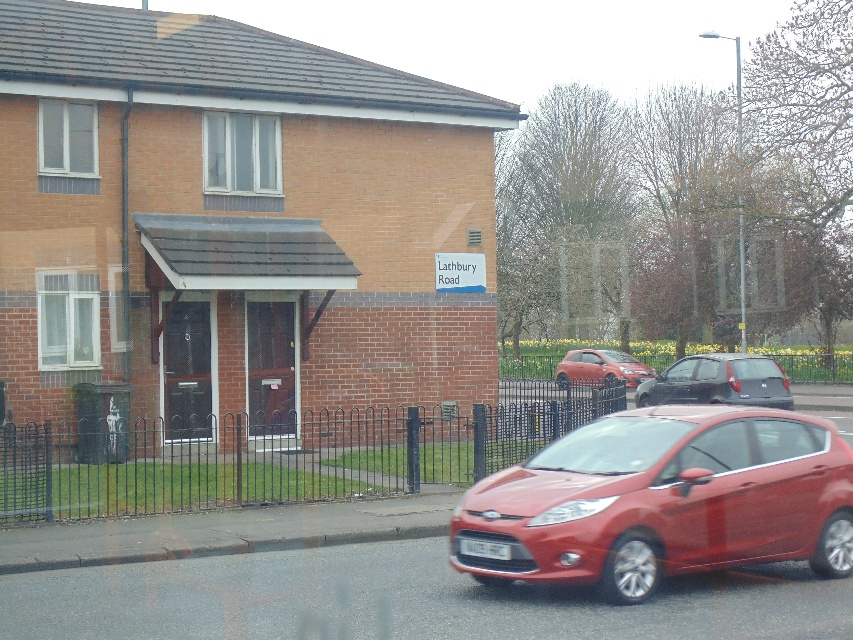
The height and width of the screenshot is (640, 853). Describe the element at coordinates (665, 500) in the screenshot. I see `matte red car at lower right` at that location.

Consider the image. Can you confirm if matte red car at lower right is positioned to the left of white plastic license plate at center?

In fact, matte red car at lower right is to the right of white plastic license plate at center.

Where is `matte red car at lower right`? The height and width of the screenshot is (640, 853). matte red car at lower right is located at coordinates (665, 500).

Who is positioned more to the right, matte red car at lower right or metallic red hatchback at center?

Positioned to the right is metallic red hatchback at center.

Does matte red car at lower right have a smaller size compared to metallic red hatchback at center?

No.

Who is more distant from viewer, (650, 593) or (563, 364)?

The point (563, 364) is more distant.

This screenshot has width=853, height=640. I want to click on matte red car at lower right, so pos(665,500).

Is satin black hatchback at center behind white plastic license plate at center?

Yes, it is behind white plastic license plate at center.

Can you confirm if satin black hatchback at center is wider than white plastic license plate at center?

No.

Between point (747, 372) and point (467, 538), which one is positioned in front?

Point (467, 538)

This screenshot has height=640, width=853. Find the location of `satin black hatchback at center`. satin black hatchback at center is located at coordinates coord(718,381).